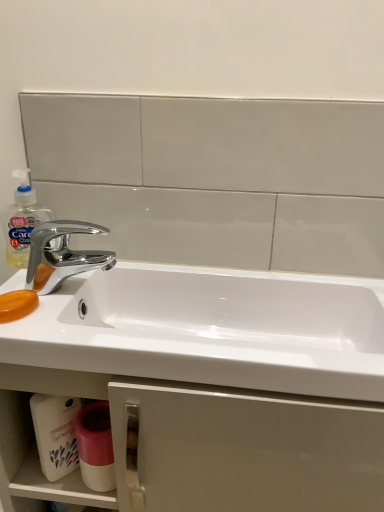
Question: From a real-world perspective, is white plastic container at lower left above or below white matte cabinet at lower center?

Choices:
 (A) below
 (B) above

Answer: (B)

Question: Is white plastic container at lower left inside the boundaries of white matte cabinet at lower center, or outside?

Choices:
 (A) outside
 (B) inside

Answer: (B)

Question: Which is nearer to the chrome/metallic faucet at left?

Choices:
 (A) white plastic container at lower left
 (B) white glossy sink at center
 (C) white matte cabinet at lower center
 (D) translucent plastic soap dispenser at left
 (E) white glossy cup at lower center

Answer: (D)

Question: Based on their relative distances, which object is nearer to the white glossy sink at center?

Choices:
 (A) white matte cabinet at lower center
 (B) white plastic container at lower left
 (C) white glossy cup at lower center
 (D) orange translucent soap at left
 (E) translucent plastic soap dispenser at left

Answer: (A)